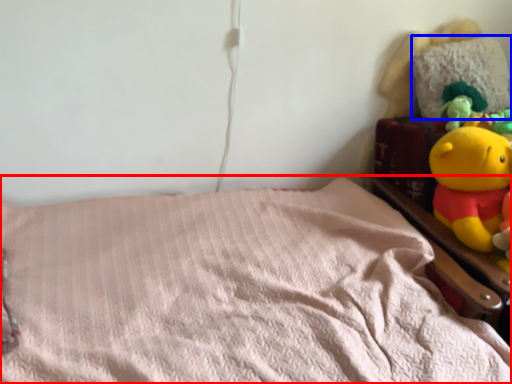
Question: Which object is further to the camera taking this photo, bed (highlighted by a red box) or pillow (highlighted by a blue box)?

Choices:
 (A) bed
 (B) pillow

Answer: (B)